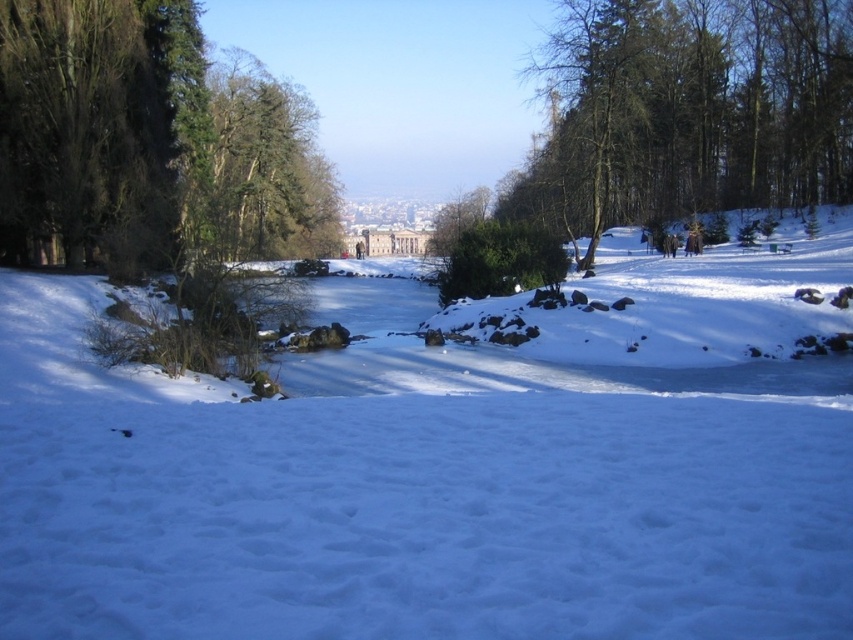
Question: Which object is farther from the camera taking this photo?

Choices:
 (A) white fluffy snow at center
 (B) green leafy tree at center

Answer: (B)

Question: Is green leafy tree at center further to the viewer compared to green matte tree at upper center?

Choices:
 (A) yes
 (B) no

Answer: (A)

Question: Does white fluffy snow at center appear on the right side of green matte tree at upper center?

Choices:
 (A) yes
 (B) no

Answer: (A)

Question: Can you confirm if white fluffy snow at center is positioned below green leafy tree at center?

Choices:
 (A) no
 (B) yes

Answer: (B)

Question: Which object is closer to the camera taking this photo?

Choices:
 (A) white fluffy snow at center
 (B) green leafy tree at center
 (C) green matte tree at upper center

Answer: (A)

Question: Which point is closer to the camera taking this photo?

Choices:
 (A) (247, 67)
 (B) (343, 612)
 (C) (477, 212)

Answer: (B)